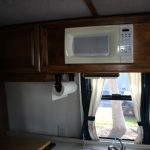
The width and height of the screenshot is (150, 150). I want to click on curtain tie back, so click(89, 117), click(140, 122).